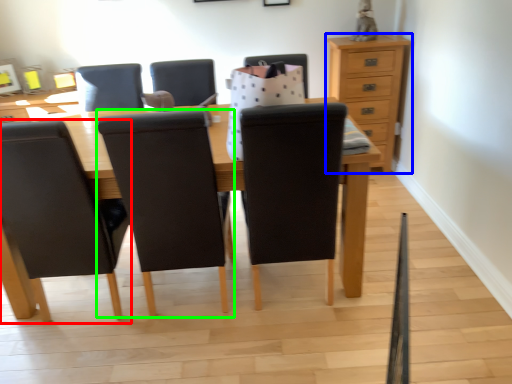
Question: Which object is the closest to the chair (highlighted by a red box)? Choose among these: chest of drawers (highlighted by a blue box) or chair (highlighted by a green box).

Choices:
 (A) chest of drawers
 (B) chair

Answer: (B)